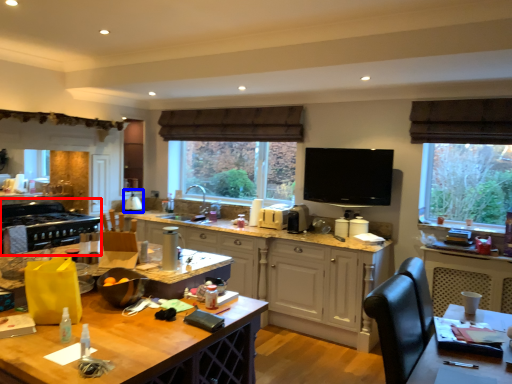
Question: Which object appears farthest to the camera in this image, appliance (highlighted by a red box) or appliance (highlighted by a blue box)?

Choices:
 (A) appliance
 (B) appliance

Answer: (B)